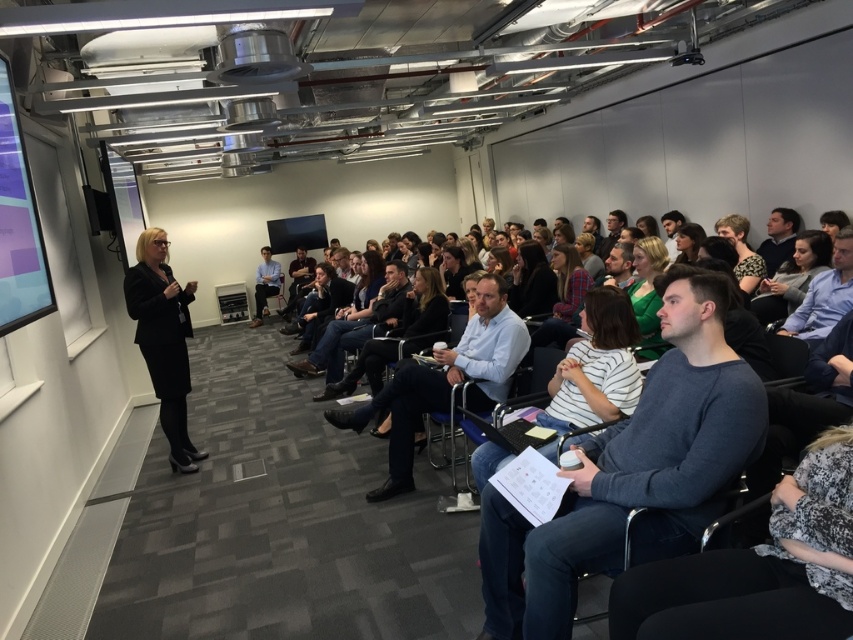
Question: Is matte black projection screen at left to the right of green fabric shirt at center from the viewer's perspective?

Choices:
 (A) yes
 (B) no

Answer: (B)

Question: Does black suit at center have a smaller size compared to matte black projection screen at left?

Choices:
 (A) no
 (B) yes

Answer: (A)

Question: Which point appears farthest from the camera in this image?

Choices:
 (A) (10, 326)
 (B) (254, 291)
 (C) (283, 285)

Answer: (C)

Question: Which of the following is the closest to the observer?

Choices:
 (A) (283, 294)
 (B) (488, 465)
 (C) (172, 417)
 (D) (732, 225)

Answer: (B)

Question: Is matte black projection screen at left below blue shirt at center?

Choices:
 (A) yes
 (B) no

Answer: (A)

Question: Which is nearer to the green fabric shirt at center?

Choices:
 (A) striped cotton shirt at center
 (B) matte black projection screen at left
 (C) patterned fabric shirt at upper right

Answer: (A)